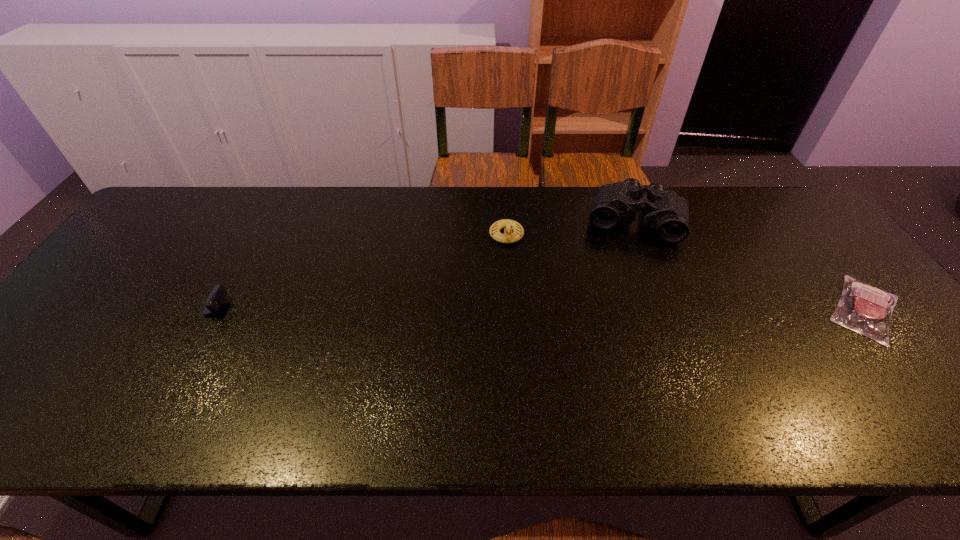
Locate an element on the screen. This screenshot has width=960, height=540. free space on the desktop that is between the leftmost object and the shortest object and is positioned on the face of the second object from left to right is located at coordinates (510, 309).

I want to click on vacant space on the desktop that is between the leftmost object and the shortest object and is positioned at the eyepieces of the tallest object, so click(622, 309).